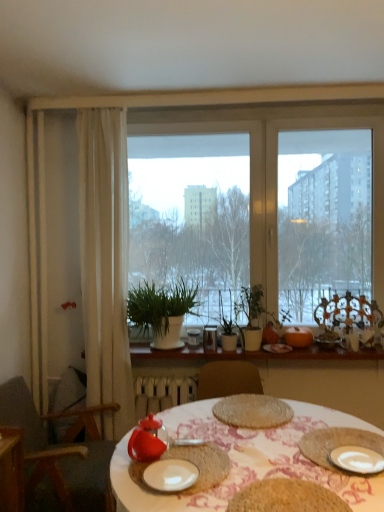
Find the location of a particular element. vacant space in between baked golden bread at center, positioned as the second food in front-to-back order, and transparent glass teapot at lower left, the fifth tableware in the right-to-left sequence is located at coordinates (210, 435).